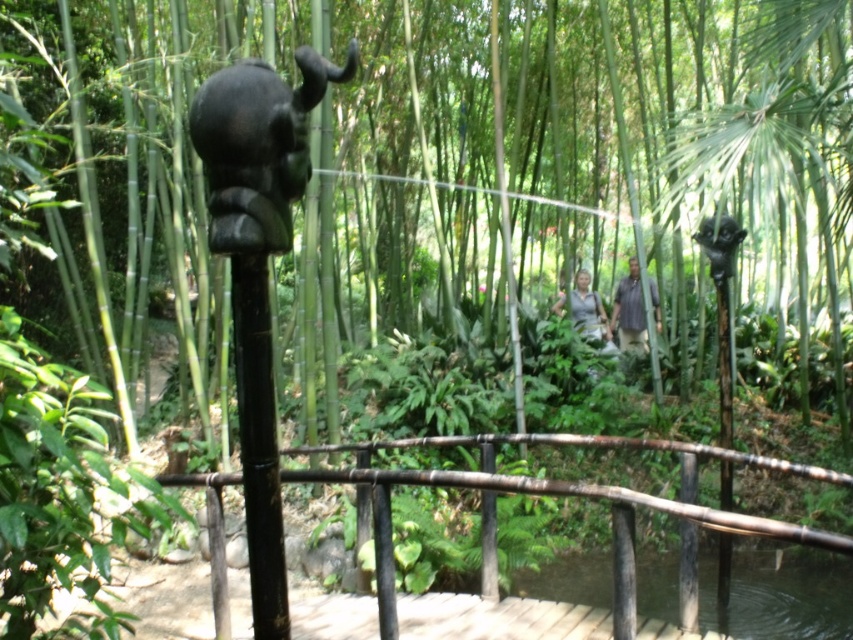
Who is lower down, clear water at pond center or black polished wood pole at right?

Positioned lower is clear water at pond center.

Between clear water at pond center and black polished wood pole at right, which one has more height?

black polished wood pole at right

Is point (596, 586) behind point (718, 384)?

No, it is not.

The height and width of the screenshot is (640, 853). Find the location of `clear water at pond center`. clear water at pond center is located at coordinates (779, 595).

Consider the image. Which is more to the right, black glossy elephant at upper center or black polished pole at center?

From the viewer's perspective, black glossy elephant at upper center appears more on the right side.

Is black glossy elephant at upper center to the left of black polished pole at center from the viewer's perspective?

No, black glossy elephant at upper center is not to the left of black polished pole at center.

Who is more forward, (260, 246) or (260, 608)?

Point (260, 246) is in front.

Identify the location of black glossy elephant at upper center. (257, 147).

Can you confirm if dark brown bamboo rail at center is thinner than black glossy elephant at upper center?

In fact, dark brown bamboo rail at center might be wider than black glossy elephant at upper center.

Is point (212, 538) behind point (279, 205)?

Yes.

The width and height of the screenshot is (853, 640). Find the location of `dark brown bamboo rail at center`. dark brown bamboo rail at center is located at coordinates (567, 496).